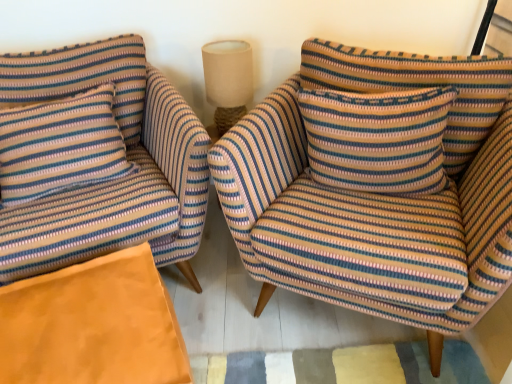
Question: Is striped fabric armchair at left, positioned as the 2th chair in right-to-left order, in front of or behind striped fabric pillow at left, positioned as the first pillow in left-to-right order, in the image?

Choices:
 (A) front
 (B) behind

Answer: (A)

Question: Does point (143, 157) appear closer or farther from the camera than point (67, 180)?

Choices:
 (A) farther
 (B) closer

Answer: (A)

Question: Which of these objects is positioned farthest from the striped fabric armchair at center, marked as the 1th chair in a right-to-left arrangement?

Choices:
 (A) beige fabric lampshade at upper center
 (B) striped fabric pillow at center, which is the 2th pillow from left to right
 (C) striped fabric armchair at left, positioned as the 2th chair in right-to-left order
 (D) orange suede ottoman at lower left
 (E) striped fabric pillow at left, positioned as the first pillow in left-to-right order

Answer: (E)

Question: Which object is the farthest from the beige fabric lampshade at upper center?

Choices:
 (A) striped fabric armchair at center, marked as the 1th chair in a right-to-left arrangement
 (B) striped fabric pillow at left, which appears as the second pillow when viewed from the right
 (C) striped fabric pillow at center, which is the 2th pillow from left to right
 (D) striped fabric armchair at left, which ranks as the first chair in left-to-right order
 (E) orange suede ottoman at lower left

Answer: (E)